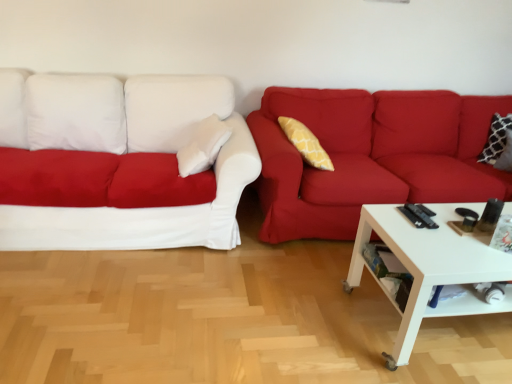
Question: Is white fabric couch at left, placed as the 2th studio couch when sorted from right to left, turned away from white glossy coffee table at lower right?

Choices:
 (A) yes
 (B) no

Answer: (B)

Question: Can you confirm if white fabric couch at left, placed as the 2th studio couch when sorted from right to left, is shorter than white glossy coffee table at lower right?

Choices:
 (A) yes
 (B) no

Answer: (B)

Question: Is white fabric couch at left, the first studio couch when ordered from left to right, to the right of white glossy coffee table at lower right from the viewer's perspective?

Choices:
 (A) yes
 (B) no

Answer: (B)

Question: Is white fabric couch at left, the first studio couch when ordered from left to right, wider than white glossy coffee table at lower right?

Choices:
 (A) yes
 (B) no

Answer: (B)

Question: Is white fabric couch at left, placed as the 2th studio couch when sorted from right to left, bigger than white glossy coffee table at lower right?

Choices:
 (A) no
 (B) yes

Answer: (B)

Question: Is white fabric couch at left, the first studio couch when ordered from left to right, beside white glossy coffee table at lower right?

Choices:
 (A) yes
 (B) no

Answer: (B)

Question: Is white glossy coffee table at lower right wider than matte red couch at right, placed as the 1th studio couch when sorted from right to left?

Choices:
 (A) yes
 (B) no

Answer: (A)

Question: Is the position of white glossy coffee table at lower right more distant than that of matte red couch at right, which is counted as the second studio couch, starting from the left?

Choices:
 (A) yes
 (B) no

Answer: (B)

Question: Can you confirm if white glossy coffee table at lower right is thinner than matte red couch at right, which is counted as the second studio couch, starting from the left?

Choices:
 (A) no
 (B) yes

Answer: (A)

Question: From the image's perspective, is white glossy coffee table at lower right under matte red couch at right, which is counted as the second studio couch, starting from the left?

Choices:
 (A) yes
 (B) no

Answer: (A)

Question: Is white glossy coffee table at lower right positioned beyond the bounds of matte red couch at right, placed as the 1th studio couch when sorted from right to left?

Choices:
 (A) no
 (B) yes

Answer: (B)

Question: Considering the relative sizes of white glossy coffee table at lower right and matte red couch at right, placed as the 1th studio couch when sorted from right to left, in the image provided, is white glossy coffee table at lower right taller than matte red couch at right, placed as the 1th studio couch when sorted from right to left,?

Choices:
 (A) yes
 (B) no

Answer: (B)

Question: Is white fabric couch at left, the first studio couch when ordered from left to right, positioned behind matte red couch at right, placed as the 1th studio couch when sorted from right to left?

Choices:
 (A) yes
 (B) no

Answer: (B)